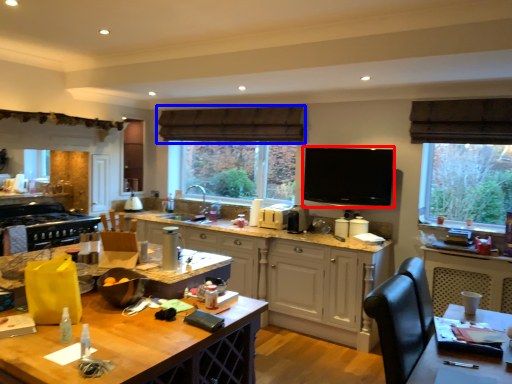
Question: Which object appears farthest to the camera in this image, appliance (highlighted by a red box) or exhaust hood (highlighted by a blue box)?

Choices:
 (A) appliance
 (B) exhaust hood

Answer: (B)